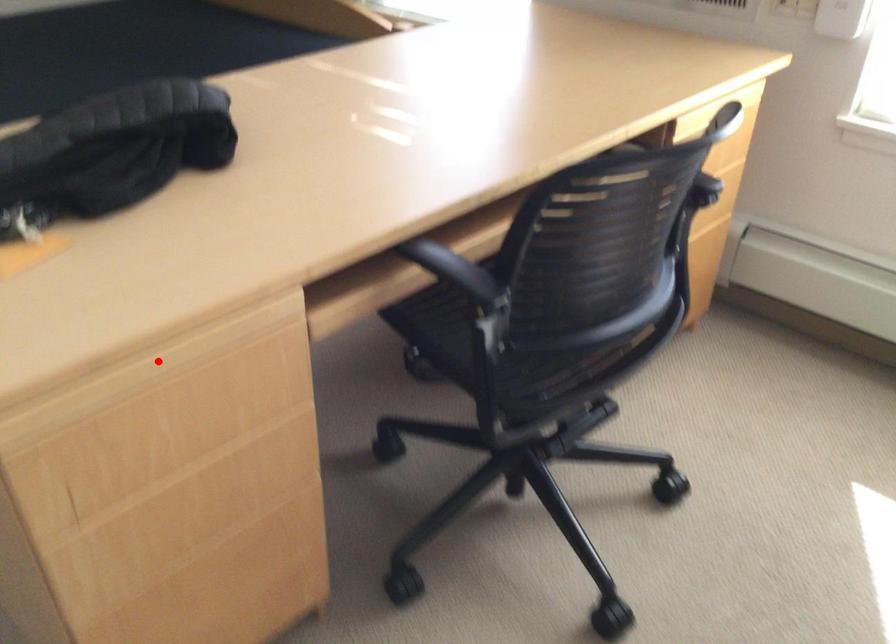
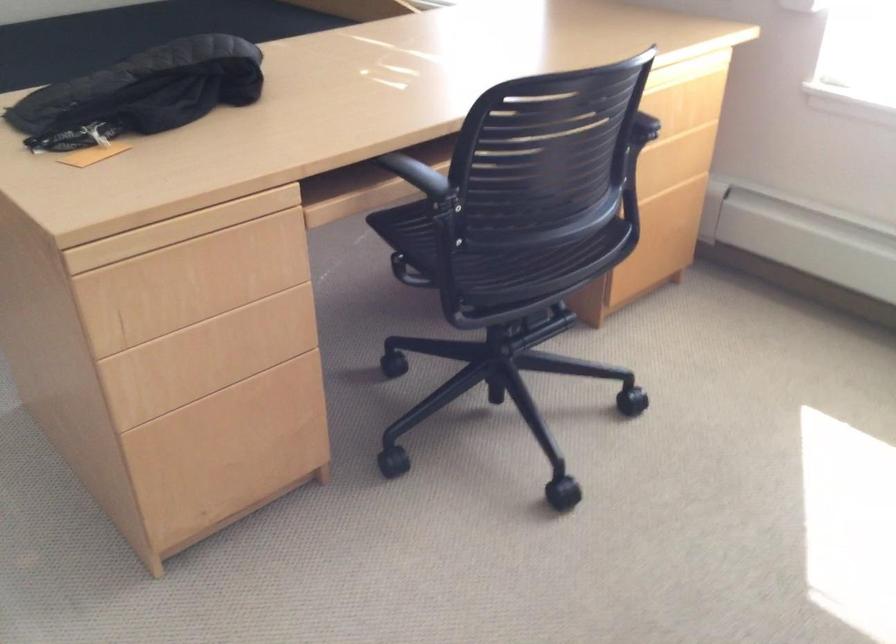
Question: I am providing you with two images of the same scene from different viewpoints. Image1 has a red point marked. In image2, the corresponding 3D location appears at what relative position? Reply with the corresponding letter.

Choices:
 (A) Closer
 (B) Farther

Answer: (B)